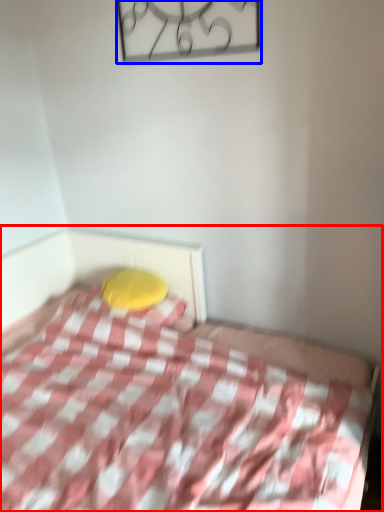
Question: Which of the following is the farthest to the observer, bed (highlighted by a red box) or design (highlighted by a blue box)?

Choices:
 (A) bed
 (B) design

Answer: (B)